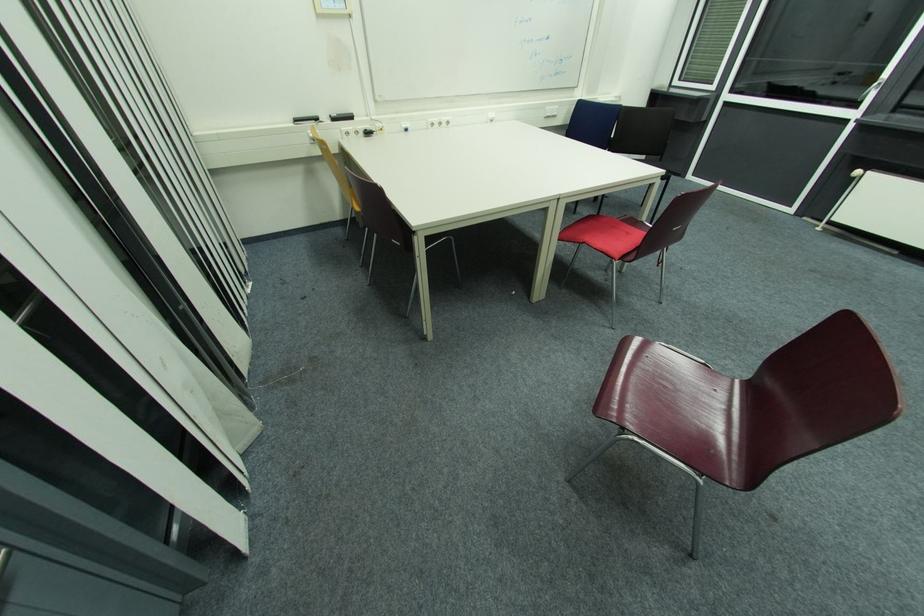
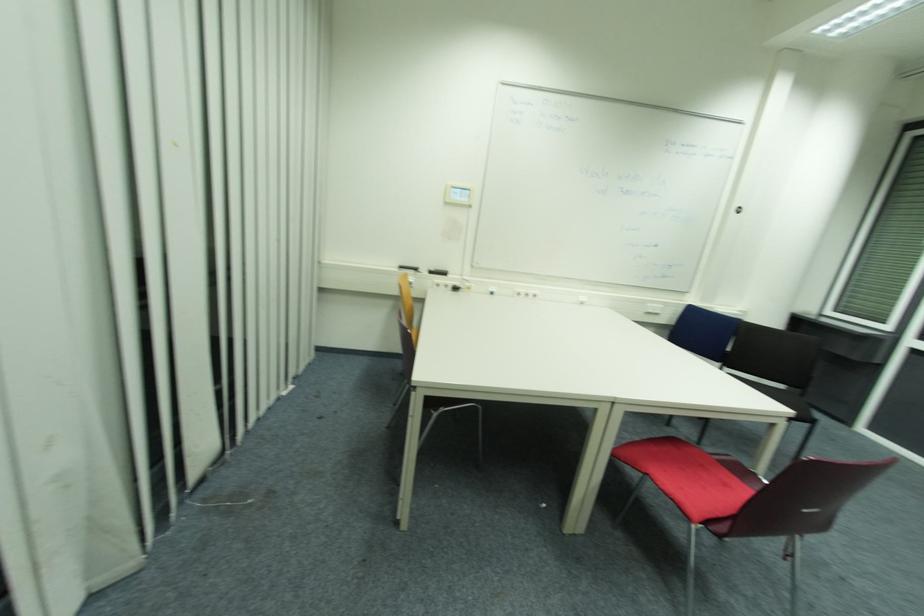
Locate, in the second image, the point that corresponds to pixel 371 134 in the first image.

(458, 290)